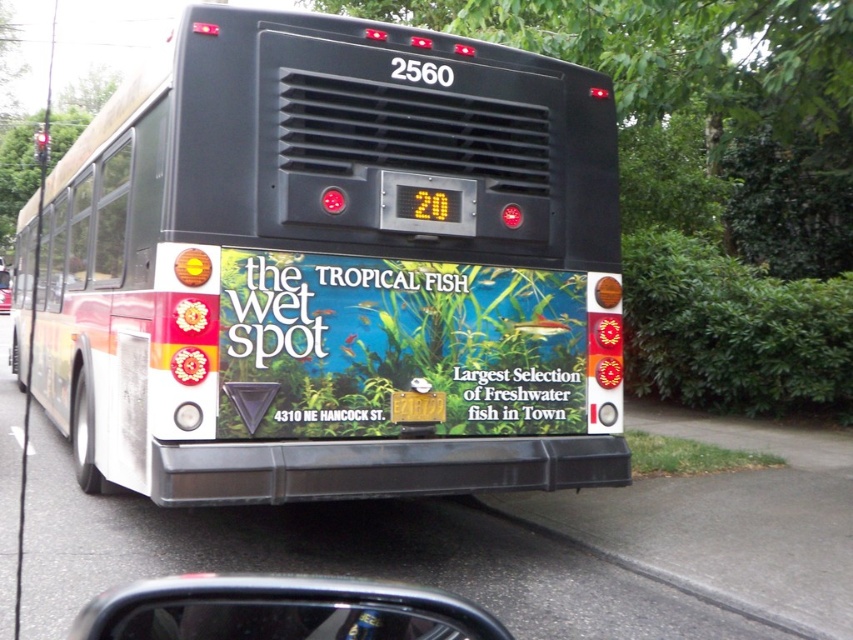
Does point (563, 365) come farther from viewer compared to point (7, 292)?

That is False.

The image size is (853, 640). Describe the element at coordinates (331, 268) in the screenshot. I see `black matte bus at center` at that location.

Find the location of `black matte bus at center`. black matte bus at center is located at coordinates (331, 268).

Does gray concrete curb at lower right have a larger size compared to metallic silver car at center?

No.

In order to click on gray concrete curb at lower right in this screenshot , I will do `click(717, 545)`.

Who is taller, black matte bus at center or matte plastic signboard at center?

black matte bus at center

Is black matte bus at center taller than matte plastic signboard at center?

Yes.

Does point (209, 384) come farther from viewer compared to point (259, 432)?

No, (209, 384) is closer to viewer.

What are the coordinates of `black matte bus at center` in the screenshot? It's located at (331, 268).